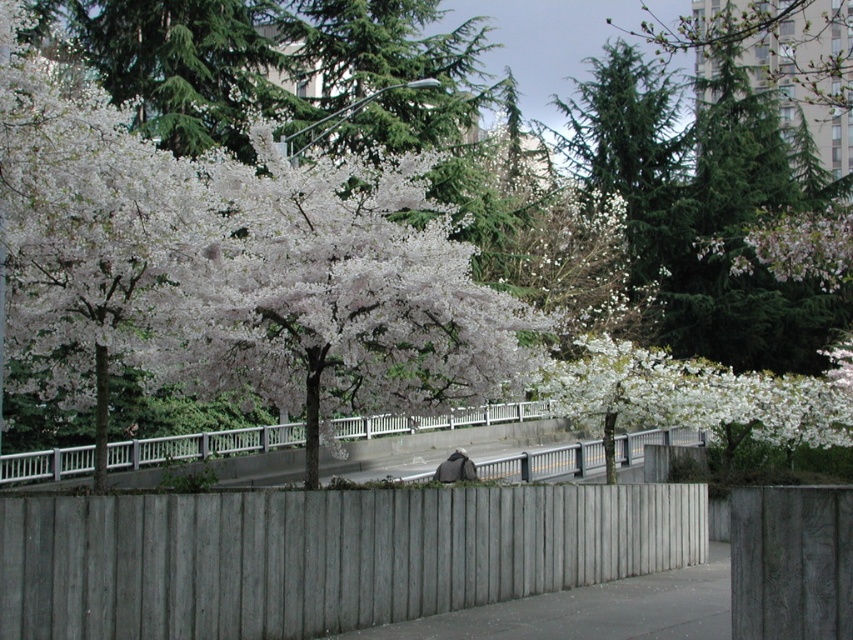
Question: Which object is closer to the camera taking this photo?

Choices:
 (A) gray wood fence at center
 (B) dark gray fabric bag at center
 (C) pink matte flower at upper right

Answer: (A)

Question: Considering the relative positions of gray concrete pavement at center and pink matte flower at upper right in the image provided, where is gray concrete pavement at center located with respect to pink matte flower at upper right?

Choices:
 (A) left
 (B) right

Answer: (A)

Question: Does white wood fence at center have a smaller size compared to dark gray fabric bag at center?

Choices:
 (A) no
 (B) yes

Answer: (A)

Question: Which object appears farthest from the camera in this image?

Choices:
 (A) gray concrete pavement at center
 (B) pink matte flower at upper right
 (C) gray wood fence at center
 (D) dark gray fabric bag at center

Answer: (D)

Question: Considering the relative positions of pink matte flower at upper right and dark gray fabric bag at center in the image provided, where is pink matte flower at upper right located with respect to dark gray fabric bag at center?

Choices:
 (A) below
 (B) above

Answer: (B)

Question: Which point is closer to the camera?

Choices:
 (A) (540, 406)
 (B) (819, 237)

Answer: (B)